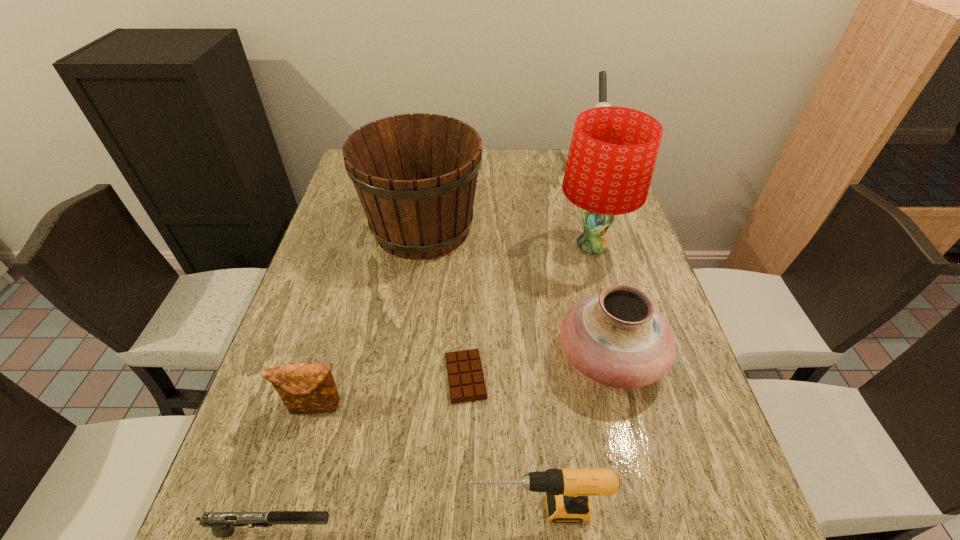
At what (x,y) coordinates should I click in order to perform the action: click on object present at the far right corner. Please return your answer as a coordinate pair (x, y). Image resolution: width=960 pixels, height=540 pixels. Looking at the image, I should click on (602, 74).

Image resolution: width=960 pixels, height=540 pixels. Identify the location of vacant region at the near edge of the desktop. (437, 534).

Locate an element on the screen. This screenshot has width=960, height=540. vacant area at the left edge is located at coordinates tap(269, 431).

The image size is (960, 540). In order to click on free region at the right edge in this screenshot , I will do (x=640, y=411).

This screenshot has width=960, height=540. I want to click on vacant area that lies between the wine bucket and the shortest object, so click(x=444, y=302).

The height and width of the screenshot is (540, 960). Find the location of `free space between the gun and the candy bar`. free space between the gun and the candy bar is located at coordinates (370, 454).

This screenshot has width=960, height=540. What are the coordinates of `vacant area between the shortest object and the pottery` in the screenshot? It's located at (538, 367).

Locate an element on the screen. The height and width of the screenshot is (540, 960). free spot between the shortest object and the nearest object is located at coordinates (370, 454).

This screenshot has height=540, width=960. I want to click on vacant area that lies between the wine bucket and the microscope, so click(x=506, y=197).

Locate an element on the screen. The width and height of the screenshot is (960, 540). vacant space that's between the microscope and the clutch bag is located at coordinates (453, 286).